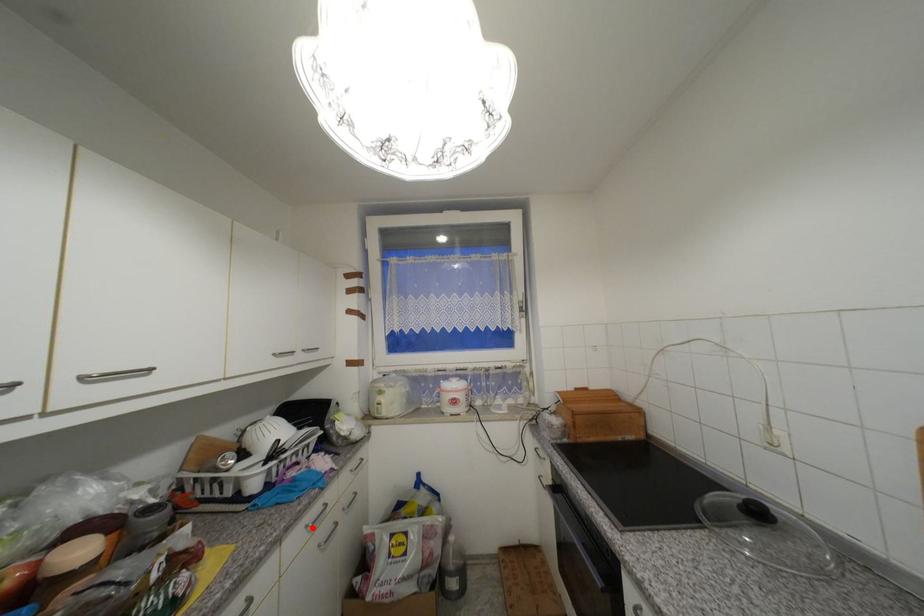
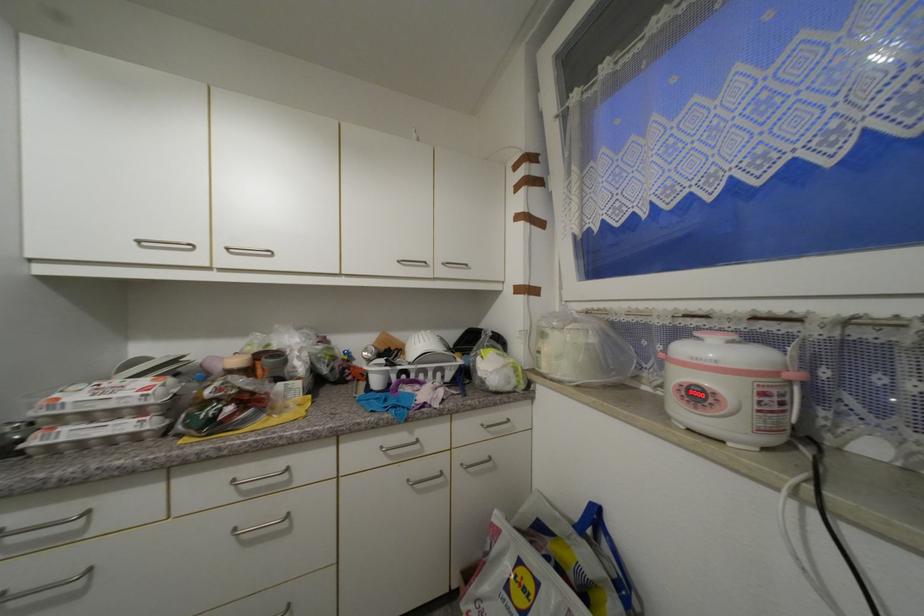
Question: I am providing you with two images of the same scene from different viewpoints. Given a red point in image1, look at the same physical point in image2. Is it:

Choices:
 (A) Closer to the viewpoint
 (B) Farther from the viewpoint

Answer: (B)